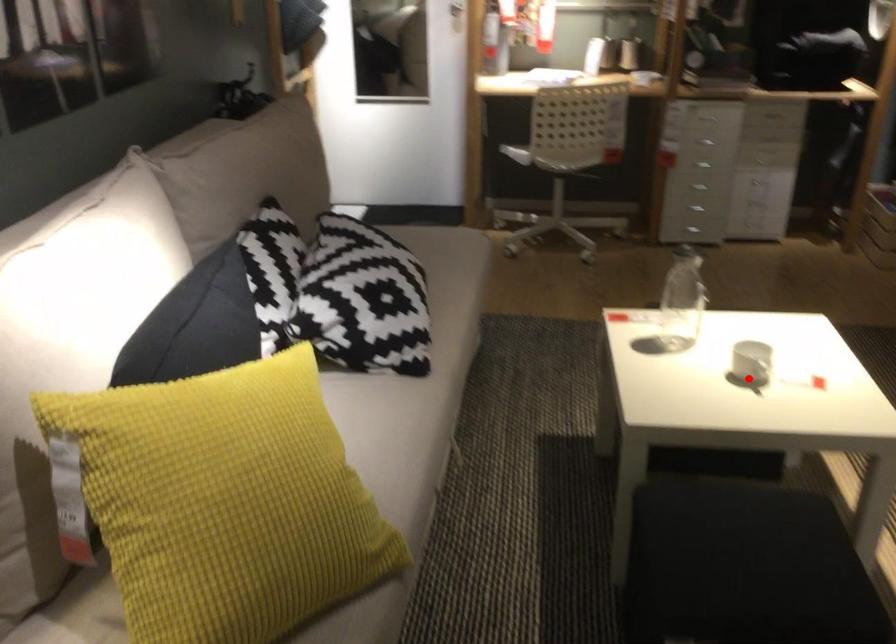
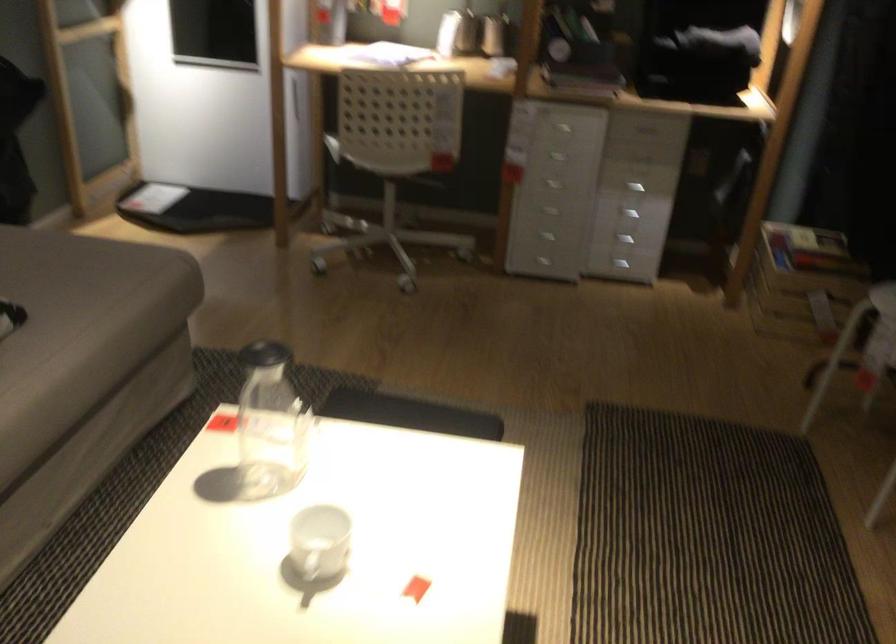
Question: I am providing you with two images of the same scene from different viewpoints. A red point is shown in image1. For the corresponding object point in image2, is it positioned nearer or farther from the camera?

Choices:
 (A) Nearer
 (B) Farther

Answer: (A)